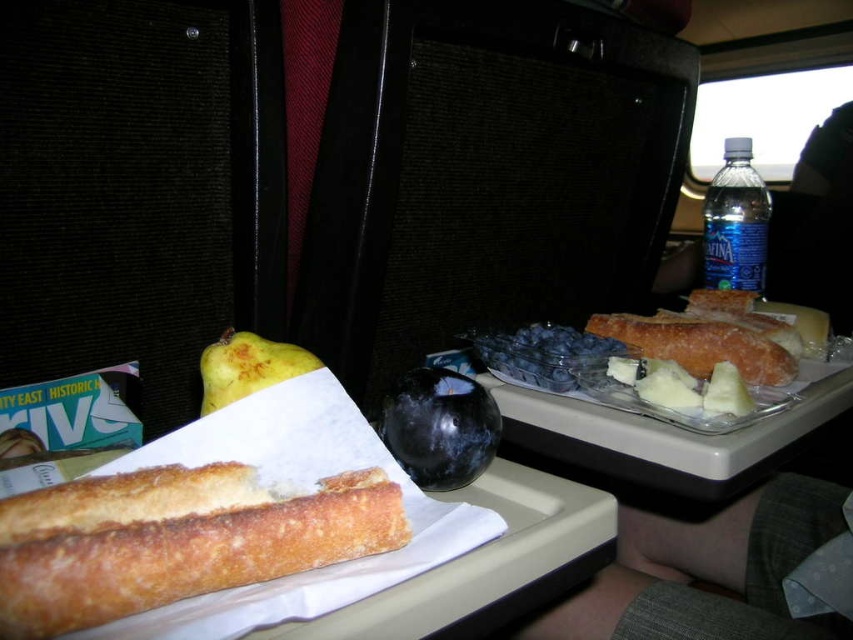
Is golden brown crusty baguette at lower left closer to camera compared to clear plastic tray at center?

That is True.

Does golden brown crusty baguette at lower left have a greater width compared to clear plastic tray at center?

In fact, golden brown crusty baguette at lower left might be narrower than clear plastic tray at center.

What do you see at coordinates (178, 545) in the screenshot?
I see `golden brown crusty baguette at lower left` at bounding box center [178, 545].

The height and width of the screenshot is (640, 853). Find the location of `golden brown crusty baguette at lower left`. golden brown crusty baguette at lower left is located at coordinates (178, 545).

Is slightly toasted bread at center below blue plastic bottle at upper right?

Yes, slightly toasted bread at center is below blue plastic bottle at upper right.

This screenshot has width=853, height=640. What do you see at coordinates (699, 346) in the screenshot?
I see `slightly toasted bread at center` at bounding box center [699, 346].

Where is `slightly toasted bread at center`? This screenshot has height=640, width=853. slightly toasted bread at center is located at coordinates (699, 346).

Can you confirm if clear plastic tray at center is positioned above yellow matte quince at center?

No.

Between clear plastic tray at center and yellow matte quince at center, which one is positioned higher?

Positioned higher is yellow matte quince at center.

Where is `clear plastic tray at center`? This screenshot has height=640, width=853. clear plastic tray at center is located at coordinates (648, 417).